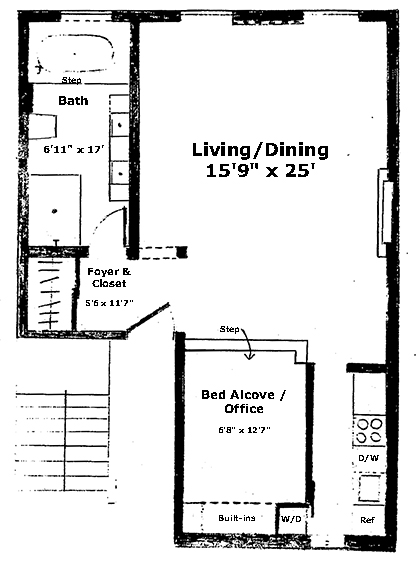
Image resolution: width=420 pixels, height=562 pixels. In order to click on kitchen in this screenshot , I will do `click(378, 433)`.